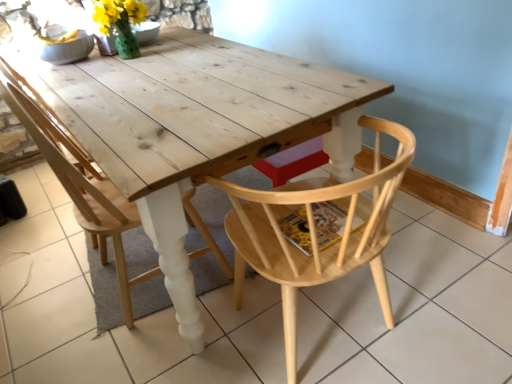
Identify the location of vacant region to the right of natural wood chair at center, the 1th chair from the right. The height and width of the screenshot is (384, 512). (446, 292).